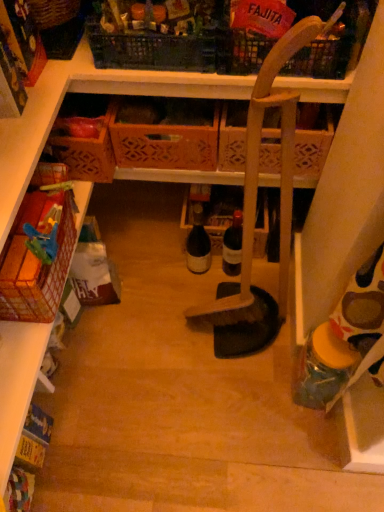
This screenshot has height=512, width=384. In order to click on vacant area that lies between translucent plastic jar at lower right, acting as the second bottle starting from the top, and wooden broom at center in this screenshot , I will do `click(261, 358)`.